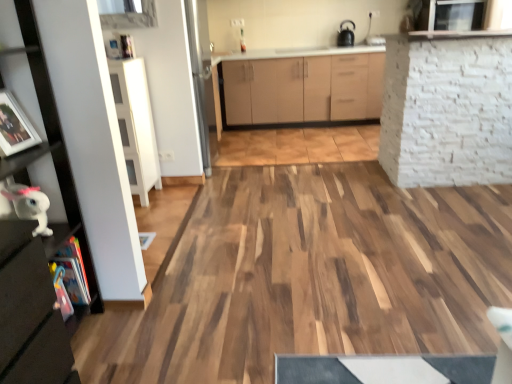
Question: From a real-world perspective, is white glossy sink at upper center positioned under white glossy plush toy at lower left based on gravity?

Choices:
 (A) no
 (B) yes

Answer: (A)

Question: Considering the relative sizes of white glossy sink at upper center and white glossy plush toy at lower left in the image provided, is white glossy sink at upper center taller than white glossy plush toy at lower left?

Choices:
 (A) no
 (B) yes

Answer: (A)

Question: Can you confirm if white glossy sink at upper center is shorter than white glossy plush toy at lower left?

Choices:
 (A) no
 (B) yes

Answer: (B)

Question: From the image's perspective, does white glossy sink at upper center appear lower than white glossy plush toy at lower left?

Choices:
 (A) no
 (B) yes

Answer: (A)

Question: Can you confirm if white glossy sink at upper center is wider than white glossy plush toy at lower left?

Choices:
 (A) yes
 (B) no

Answer: (A)

Question: Is black matte kettle at upper center inside the boundaries of matte black shelf at left, marked as the second cabinetry in a back-to-front arrangement, or outside?

Choices:
 (A) outside
 (B) inside

Answer: (A)

Question: Relative to matte black shelf at left, acting as the 2th cabinetry starting from the top, is black matte kettle at upper center in front or behind?

Choices:
 (A) behind
 (B) front

Answer: (A)

Question: Considering the positions of black matte kettle at upper center and matte black shelf at left, marked as the 1th cabinetry in a front-to-back arrangement, in the image, is black matte kettle at upper center bigger or smaller than matte black shelf at left, marked as the 1th cabinetry in a front-to-back arrangement,?

Choices:
 (A) big
 (B) small

Answer: (B)

Question: In terms of width, does black matte kettle at upper center look wider or thinner when compared to matte black shelf at left, positioned as the first cabinetry in bottom-to-top order?

Choices:
 (A) wide
 (B) thin

Answer: (B)

Question: From the image's perspective, is black matte kettle at upper center above or below white glossy sink at upper center?

Choices:
 (A) below
 (B) above

Answer: (B)

Question: Considering the positions of black matte kettle at upper center and white glossy sink at upper center in the image, is black matte kettle at upper center taller or shorter than white glossy sink at upper center?

Choices:
 (A) short
 (B) tall

Answer: (B)

Question: Is black matte kettle at upper center wider or thinner than white glossy sink at upper center?

Choices:
 (A) thin
 (B) wide

Answer: (A)

Question: From a real-world perspective, is black matte kettle at upper center physically located above or below white glossy sink at upper center?

Choices:
 (A) below
 (B) above

Answer: (B)

Question: In terms of height, does white brick wall at upper right look taller or shorter compared to white glossy sink at upper center?

Choices:
 (A) short
 (B) tall

Answer: (B)

Question: From the image's perspective, is white brick wall at upper right above or below white glossy sink at upper center?

Choices:
 (A) above
 (B) below

Answer: (B)